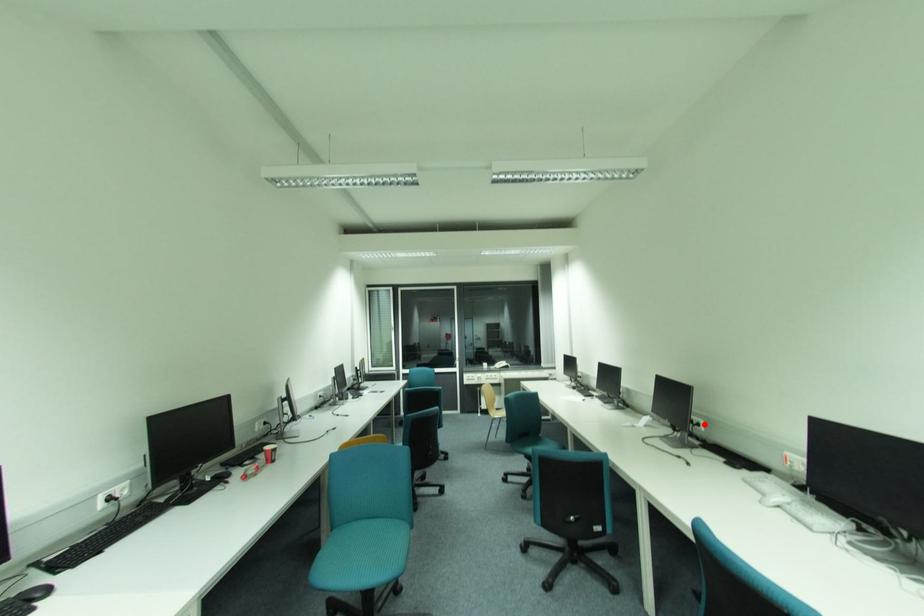
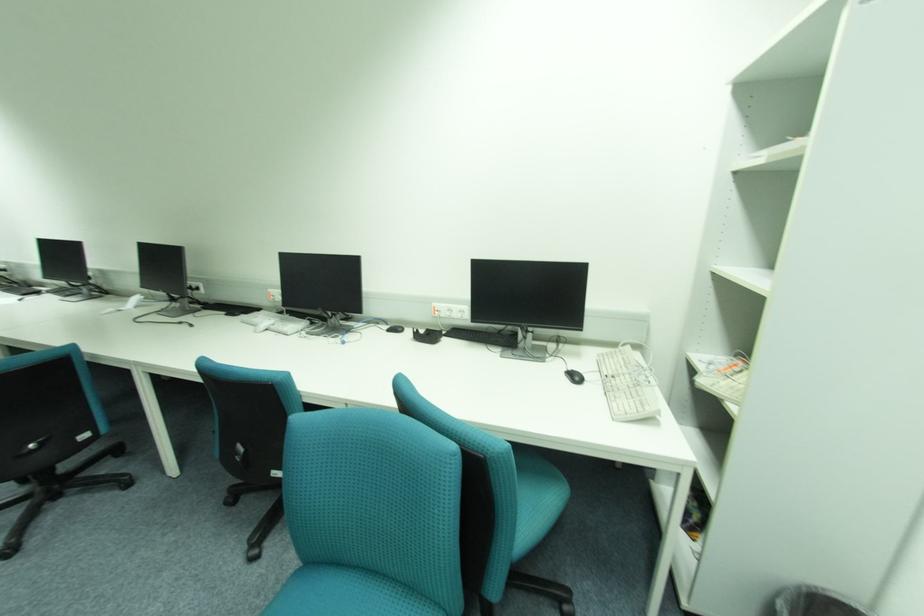
Locate, in the second image, the point that corresponds to the highlighted location in the first image.

(203, 289)